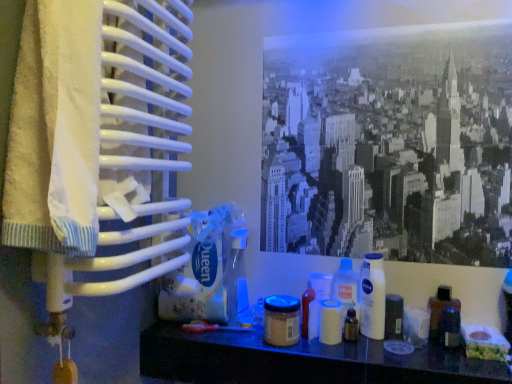
Locate an element on the screen. This screenshot has width=512, height=384. vacant area to the right of white plastic jar at center, the 5th toiletry when ordered from left to right is located at coordinates (396, 358).